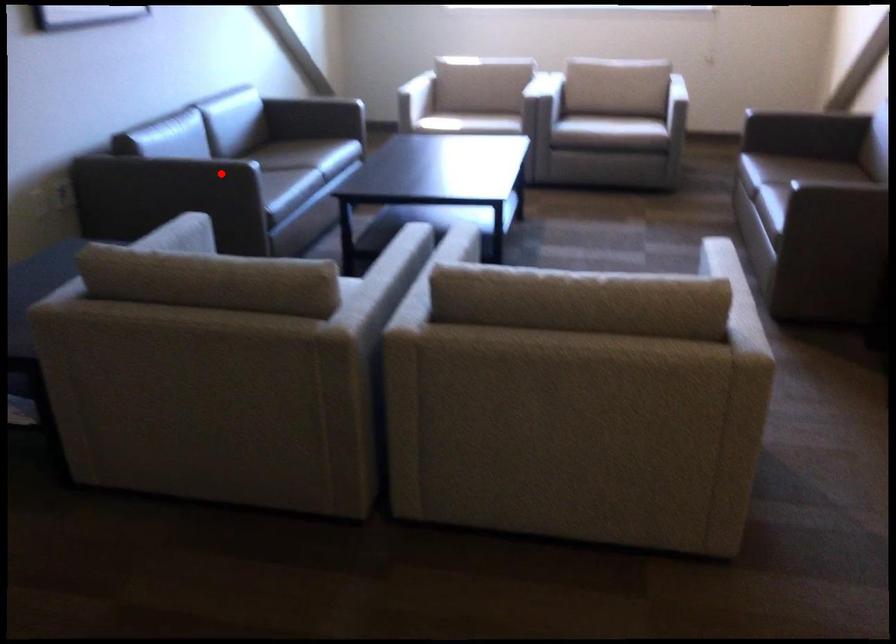
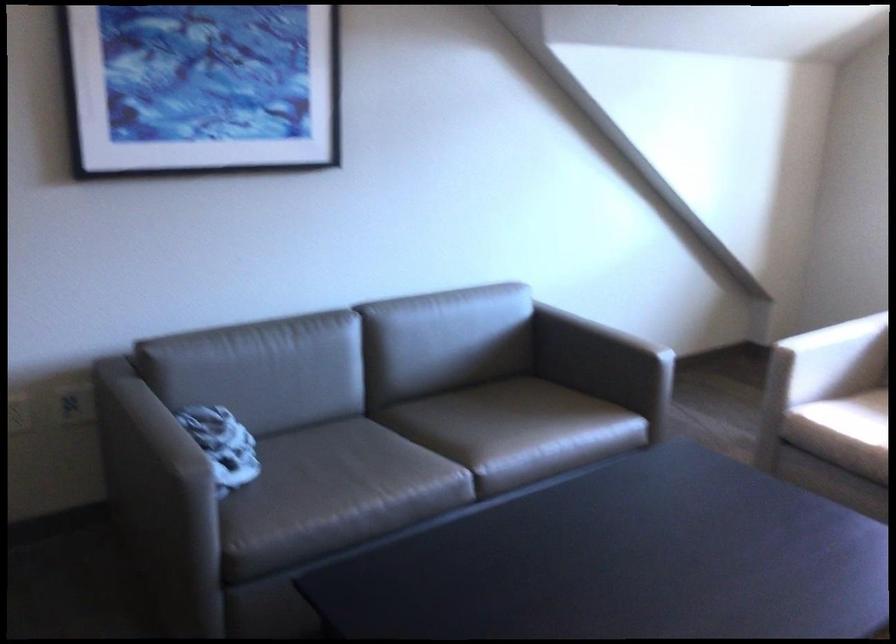
Locate, in the second image, the point that corresponds to the highlighted location in the first image.

(158, 491)